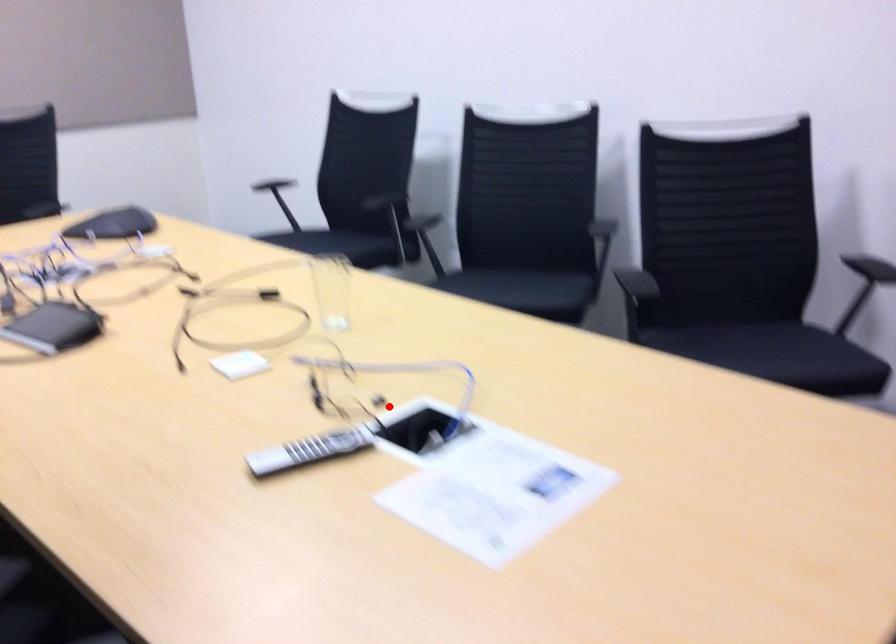
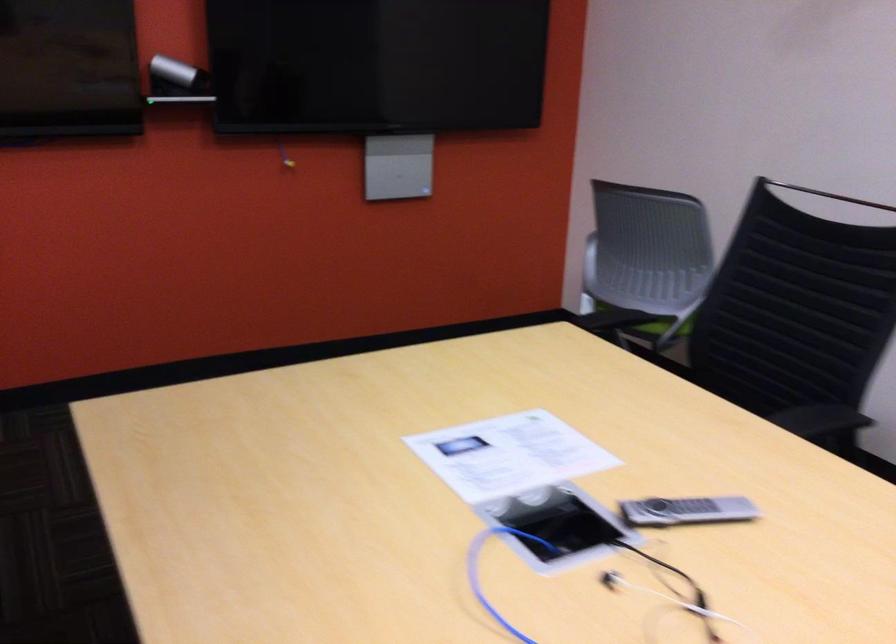
Question: I am providing you with two images of the same scene from different viewpoints. A red point is shown in image1. For the corresponding object point in image2, is it positioned nearer or farther from the camera?

Choices:
 (A) Nearer
 (B) Farther

Answer: (A)